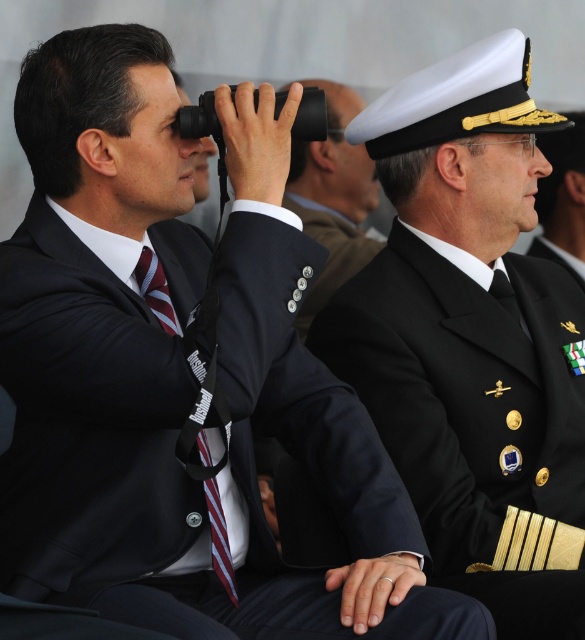
Question: Which of the following is the closest to the observer?

Choices:
 (A) black matte uniform at center
 (B) striped fabric tie at center

Answer: (B)

Question: Can you confirm if black matte uniform at center is positioned to the right of matte black binoculars at center?

Choices:
 (A) yes
 (B) no

Answer: (A)

Question: Which point is closer to the camera taking this photo?

Choices:
 (A) (152, 268)
 (B) (307, 220)
 (C) (442, 556)

Answer: (A)

Question: Does black matte uniform at center have a greater width compared to matte black binoculars at center?

Choices:
 (A) yes
 (B) no

Answer: (A)

Question: Is matte black binoculars at center smaller than striped fabric tie at center?

Choices:
 (A) yes
 (B) no

Answer: (B)

Question: Which point appears closest to the camera in this image?

Choices:
 (A) (556, 598)
 (B) (139, 285)
 (C) (307, 163)

Answer: (A)